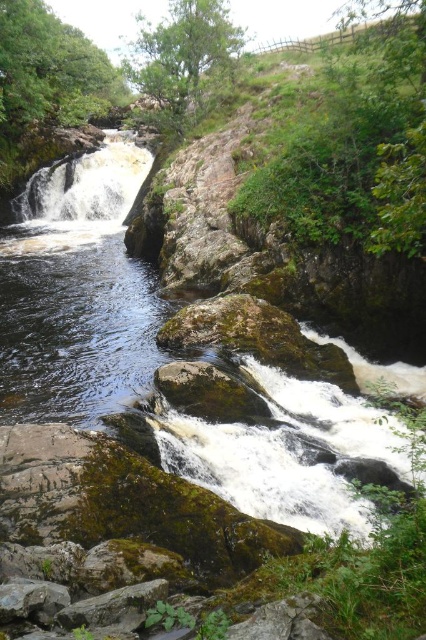
You are standing at the edge of the river in the scene and want to reach the point marked as point (88, 182). Based on the description, is this point located on the white frothy water at center?

Yes, the point (88, 182) is on the white frothy water at center according to the description.

You are a hiker who wants to cross the river using a 60 feet long rope bridge. You notice the white frothy water at center and the green mossy rock at center in the scene. Can you safely cross the river using the bridge without getting too close to the white frothy water?

The distance between the white frothy water at center and the green mossy rock at center is 61.40 feet. Since the rope bridge is only 60 feet long, it would be too short to span the gap safely. Therefore, you cannot cross the river using the bridge without getting too close to the white frothy water.